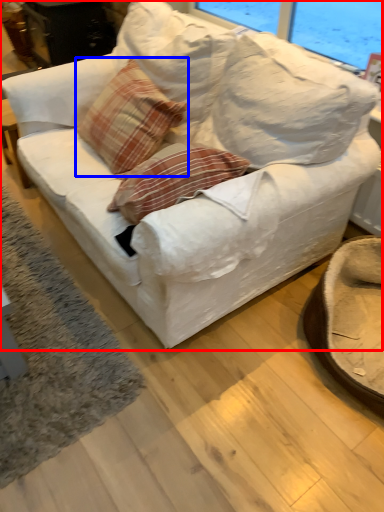
Question: Which object is further to the camera taking this photo, studio couch (highlighted by a red box) or throw pillow (highlighted by a blue box)?

Choices:
 (A) studio couch
 (B) throw pillow

Answer: (B)